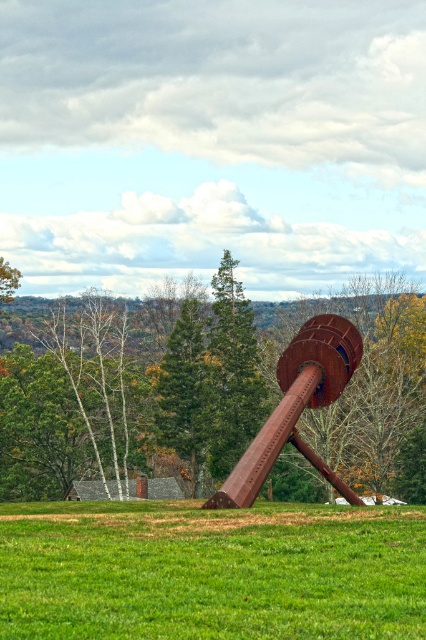
You are standing at the point marked by the brown textured tree at center. Looking towards the sculpture, which direction would you face? The sculpture is located at coordinates point (129, 400). Please provide your answer based on the given coordinates.

The brown textured tree at center is located at point (129, 400), which is the same coordinates as the sculpture. Therefore, you are already at the sculpture and facing any direction would not change your position.